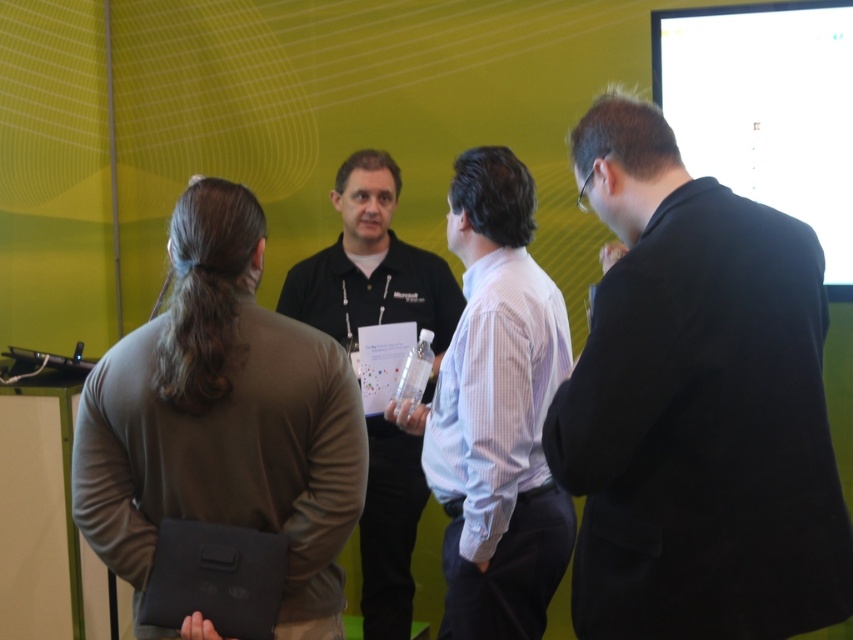
Question: Is black suit at right to the right of white glossy screen at upper right from the viewer's perspective?

Choices:
 (A) yes
 (B) no

Answer: (B)

Question: Which of the following is the closest to the observer?

Choices:
 (A) 355,268
 (B) 640,204
 (C) 509,193
 (D) 221,184

Answer: (B)

Question: Which object is the farthest from the black shirt at center?

Choices:
 (A) white glossy screen at upper right
 (B) brown matte laptop at left
 (C) white striped shirt at center

Answer: (A)

Question: Which of these objects is positioned closest to the white striped shirt at center?

Choices:
 (A) white glossy screen at upper right
 (B) black suit at right

Answer: (B)

Question: Can you confirm if black suit at right is bigger than white striped shirt at center?

Choices:
 (A) yes
 (B) no

Answer: (B)

Question: In this image, where is white glossy screen at upper right located relative to black shirt at center?

Choices:
 (A) above
 (B) below

Answer: (A)